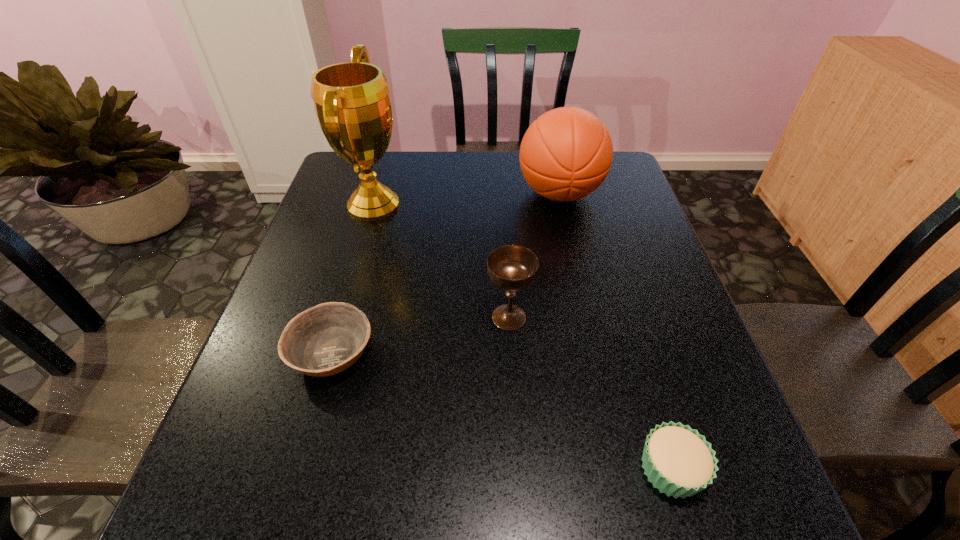
The image size is (960, 540). I want to click on award located in the far edge section of the desktop, so click(x=352, y=103).

Identify the location of basketball present at the far edge. (566, 154).

Where is `object present at the near edge`? object present at the near edge is located at coordinates (678, 461).

Locate an element on the screen. award present at the left edge is located at coordinates (352, 103).

The width and height of the screenshot is (960, 540). Identify the location of bowl at the left edge. (324, 340).

Find the location of `basketball present at the right edge`. basketball present at the right edge is located at coordinates (566, 154).

Identify the location of cupcake located at the right edge. The width and height of the screenshot is (960, 540). (678, 461).

This screenshot has height=540, width=960. Find the location of `object that is at the far left corner`. object that is at the far left corner is located at coordinates (352, 103).

Find the location of a particular element. This screenshot has width=960, height=540. object present at the far right corner is located at coordinates (566, 154).

Image resolution: width=960 pixels, height=540 pixels. Find the location of `object at the near right corner`. object at the near right corner is located at coordinates (678, 461).